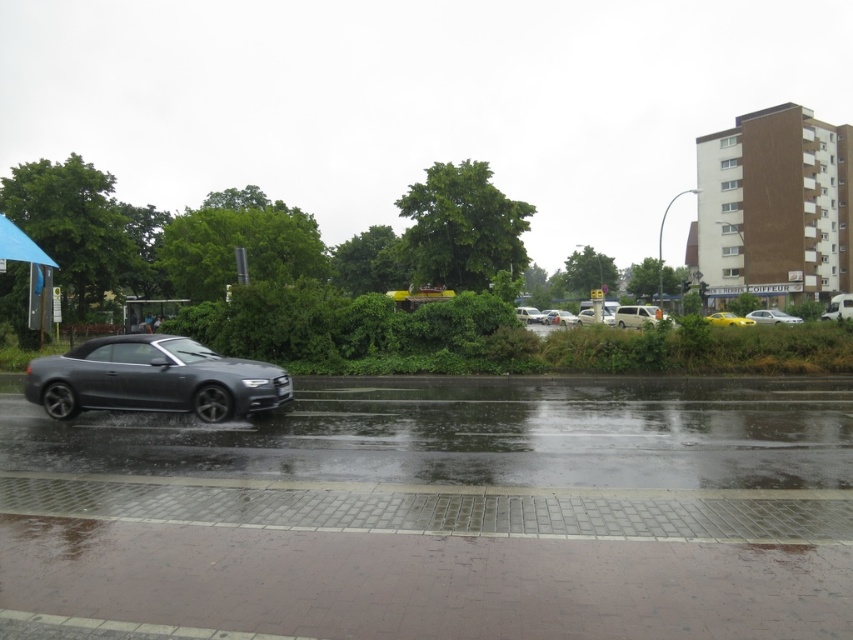
Looking at this image, is silver metallic sedan at center wider than yellow matte car at center?

No.

Can you confirm if silver metallic sedan at center is taller than yellow matte car at center?

Incorrect, silver metallic sedan at center's height is not larger of yellow matte car at center's.

Is point (798, 321) positioned after point (740, 324)?

Yes, it is behind point (740, 324).

Identify the location of silver metallic sedan at center. (770, 316).

Who is higher up, yellow matte car at center or matte silver car at center?

Positioned higher is matte silver car at center.

Does point (750, 321) lie behind point (552, 310)?

No, (750, 321) is in front of (552, 310).

Where is `yellow matte car at center`? yellow matte car at center is located at coordinates (728, 320).

Does yellow matte car at center have a smaller size compared to white matte car at center?

Incorrect, yellow matte car at center is not smaller in size than white matte car at center.

Does yellow matte car at center have a lesser height compared to white matte car at center?

Yes, yellow matte car at center is shorter than white matte car at center.

Does point (721, 323) come behind point (538, 314)?

No, (721, 323) is in front of (538, 314).

This screenshot has height=640, width=853. In order to click on yellow matte car at center in this screenshot , I will do [728, 320].